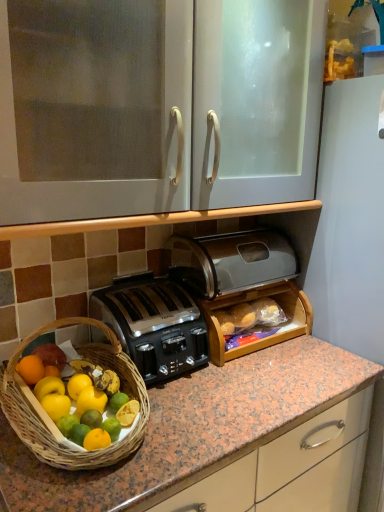
Question: Is satin black toaster at center, the 1th toaster ordered from the bottom, wider than wooden bread box at center, acting as the first cabinetry starting from the bottom?

Choices:
 (A) yes
 (B) no

Answer: (A)

Question: Does satin black toaster at center, placed as the second toaster when sorted from top to bottom, come behind wooden bread box at center, which is the second cabinetry in top-to-bottom order?

Choices:
 (A) no
 (B) yes

Answer: (A)

Question: Is satin black toaster at center, the 1th toaster ordered from the bottom, thinner than wooden bread box at center, which is the second cabinetry in top-to-bottom order?

Choices:
 (A) yes
 (B) no

Answer: (B)

Question: Is satin black toaster at center, the 1th toaster ordered from the bottom, shorter than wooden bread box at center, which is the second cabinetry in top-to-bottom order?

Choices:
 (A) yes
 (B) no

Answer: (B)

Question: From the image's perspective, is satin black toaster at center, placed as the second toaster when sorted from top to bottom, on top of wooden bread box at center, acting as the first cabinetry starting from the bottom?

Choices:
 (A) yes
 (B) no

Answer: (B)

Question: Does point (167, 296) appear closer or farther from the camera than point (119, 143)?

Choices:
 (A) farther
 (B) closer

Answer: (A)

Question: In the image, is satin black toaster at center, the 1th toaster ordered from the bottom, positioned in front of or behind white glossy cabinet at upper center, the second cabinetry ordered from the bottom?

Choices:
 (A) behind
 (B) front

Answer: (A)

Question: Is satin black toaster at center, placed as the second toaster when sorted from top to bottom, spatially inside white glossy cabinet at upper center, the second cabinetry ordered from the bottom, or outside of it?

Choices:
 (A) inside
 (B) outside

Answer: (B)

Question: Looking at their shapes, would you say satin black toaster at center, placed as the second toaster when sorted from top to bottom, is wider or thinner than white glossy cabinet at upper center, the second cabinetry ordered from the bottom?

Choices:
 (A) thin
 (B) wide

Answer: (A)

Question: Is satin black toaster at center, arranged as the first toaster when viewed from the top, wider or thinner than satin black toaster at center, the 1th toaster ordered from the bottom?

Choices:
 (A) thin
 (B) wide

Answer: (A)

Question: From a real-world perspective, is satin black toaster at center, arranged as the first toaster when viewed from the top, above or below satin black toaster at center, placed as the second toaster when sorted from top to bottom?

Choices:
 (A) below
 (B) above

Answer: (B)

Question: Is satin black toaster at center, arranged as the first toaster when viewed from the top, in front of or behind satin black toaster at center, the 1th toaster ordered from the bottom, in the image?

Choices:
 (A) front
 (B) behind

Answer: (B)

Question: Based on their sizes in the image, would you say satin black toaster at center, arranged as the second toaster when ordered from the bottom, is bigger or smaller than satin black toaster at center, the 1th toaster ordered from the bottom?

Choices:
 (A) big
 (B) small

Answer: (A)

Question: Considering the positions of white glossy cabinet at upper center, the second cabinetry ordered from the bottom, and satin black toaster at center, arranged as the second toaster when ordered from the bottom, in the image, is white glossy cabinet at upper center, the second cabinetry ordered from the bottom, wider or thinner than satin black toaster at center, arranged as the second toaster when ordered from the bottom,?

Choices:
 (A) thin
 (B) wide

Answer: (B)

Question: From the image's perspective, relative to satin black toaster at center, arranged as the second toaster when ordered from the bottom, is white glossy cabinet at upper center, the second cabinetry ordered from the bottom, above or below?

Choices:
 (A) below
 (B) above

Answer: (B)